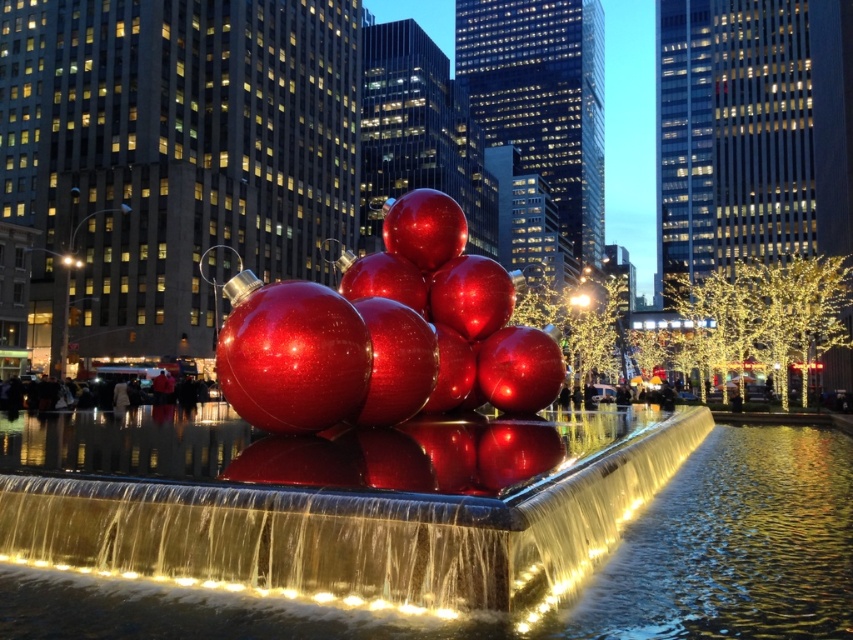
Question: Does glossy metallic fountain at center come in front of glossy metallic water at center?

Choices:
 (A) yes
 (B) no

Answer: (B)

Question: Is glossy metallic fountain at center thinner than glossy metallic water at center?

Choices:
 (A) yes
 (B) no

Answer: (A)

Question: Which object appears closest to the camera in this image?

Choices:
 (A) glossy metallic water at center
 (B) glossy metallic fountain at center

Answer: (A)

Question: Which of the following is the farthest from the observer?

Choices:
 (A) (331, 611)
 (B) (367, 563)

Answer: (A)

Question: Does glossy metallic fountain at center appear on the right side of glossy metallic water at center?

Choices:
 (A) no
 (B) yes

Answer: (A)

Question: Which of the following is the closest to the observer?

Choices:
 (A) (271, 497)
 (B) (822, 488)

Answer: (A)